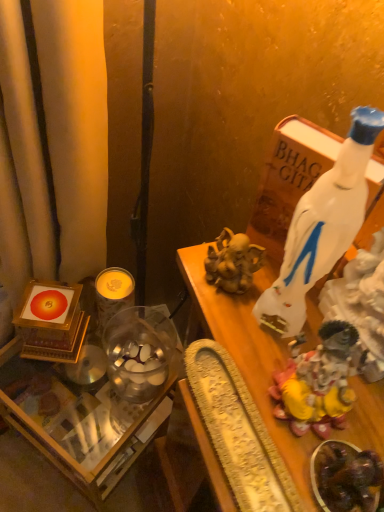
Question: Considering the relative sizes of shiny dark chocolate at lower right and shiny gold statue at right in the image provided, is shiny dark chocolate at lower right bigger than shiny gold statue at right?

Choices:
 (A) yes
 (B) no

Answer: (B)

Question: Does shiny dark chocolate at lower right come in front of shiny gold statue at right?

Choices:
 (A) no
 (B) yes

Answer: (B)

Question: Are shiny dark chocolate at lower right and shiny gold statue at right far apart?

Choices:
 (A) yes
 (B) no

Answer: (B)

Question: Can you confirm if shiny dark chocolate at lower right is taller than shiny gold statue at right?

Choices:
 (A) no
 (B) yes

Answer: (A)

Question: From the image's perspective, is shiny dark chocolate at lower right below shiny gold statue at right?

Choices:
 (A) yes
 (B) no

Answer: (A)

Question: In terms of height, does translucent glass table at lower left look taller or shorter compared to yellow wax candle at center left?

Choices:
 (A) tall
 (B) short

Answer: (A)

Question: Based on their sizes in the image, would you say translucent glass table at lower left is bigger or smaller than yellow wax candle at center left?

Choices:
 (A) small
 (B) big

Answer: (B)

Question: From the image's perspective, is translucent glass table at lower left positioned above or below yellow wax candle at center left?

Choices:
 (A) below
 (B) above

Answer: (A)

Question: Is translucent glass table at lower left in front of or behind yellow wax candle at center left in the image?

Choices:
 (A) front
 (B) behind

Answer: (A)

Question: In the image, is shiny gold statue at right positioned in front of or behind gold textured tray at center?

Choices:
 (A) front
 (B) behind

Answer: (B)

Question: Is shiny gold statue at right taller or shorter than gold textured tray at center?

Choices:
 (A) tall
 (B) short

Answer: (B)

Question: From the image's perspective, relative to gold textured tray at center, is shiny gold statue at right above or below?

Choices:
 (A) below
 (B) above

Answer: (B)

Question: From a real-world perspective, relative to gold textured tray at center, is shiny gold statue at right vertically above or below?

Choices:
 (A) below
 (B) above

Answer: (B)

Question: In terms of width, does yellow wax candle at center left look wider or thinner when compared to translucent glass table at lower left?

Choices:
 (A) thin
 (B) wide

Answer: (A)

Question: Is yellow wax candle at center left in front of or behind translucent glass table at lower left in the image?

Choices:
 (A) front
 (B) behind

Answer: (B)